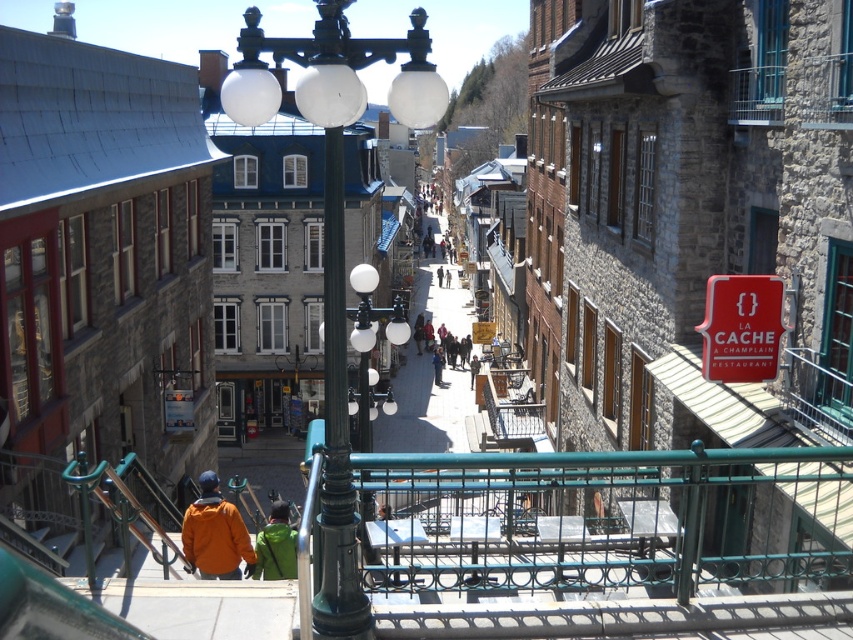
Between green polished metal street light at center and red matte sign at center right, which one is positioned lower?

green polished metal street light at center is lower down.

Between point (316, 22) and point (735, 333), which one is positioned behind?

Positioned behind is point (735, 333).

The image size is (853, 640). I want to click on green polished metal street light at center, so click(x=334, y=240).

Which is behind, point (193, 560) or point (274, 529)?

Point (274, 529)

At what (x,y) coordinates should I click in order to perform the action: click on orange fleece jacket at lower left. Please return your answer as a coordinate pair (x, y). This screenshot has width=853, height=640. Looking at the image, I should click on (213, 532).

Is point (352, 563) farther from camera compared to point (434, 374)?

That is False.

Is black metal pole at center to the right of green fabric jacket at center from the viewer's perspective?

No, black metal pole at center is not to the right of green fabric jacket at center.

The height and width of the screenshot is (640, 853). Describe the element at coordinates (335, 435) in the screenshot. I see `black metal pole at center` at that location.

Locate an element on the screen. black metal pole at center is located at coordinates (335, 435).